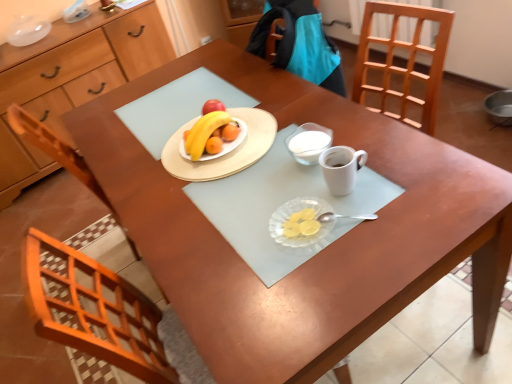
The height and width of the screenshot is (384, 512). In order to click on vacant space that is to the left of matte wooden plate at center in this screenshot , I will do `click(128, 160)`.